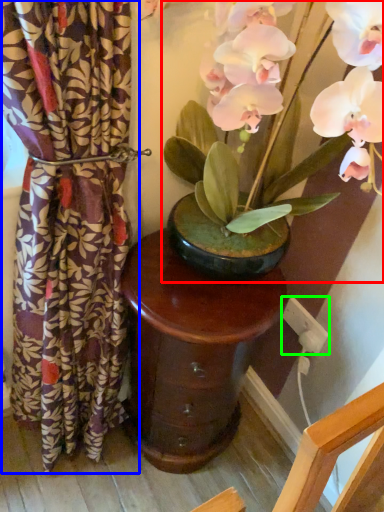
Question: Which is nearer to the houseplant (highlighted by a red box)? curtain (highlighted by a blue box) or electric outlet (highlighted by a green box).

Choices:
 (A) curtain
 (B) electric outlet

Answer: (A)